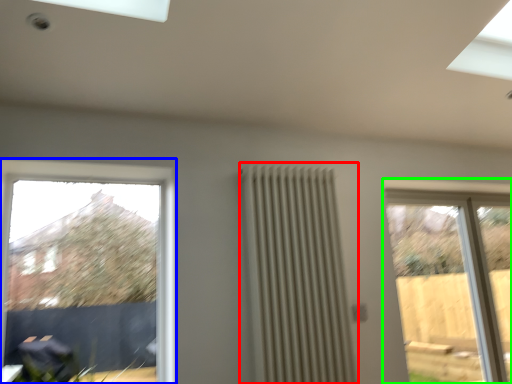
Question: Considering the real-world distances, which object is farthest from radiator (highlighted by a red box)? window (highlighted by a blue box) or window (highlighted by a green box)?

Choices:
 (A) window
 (B) window

Answer: (B)